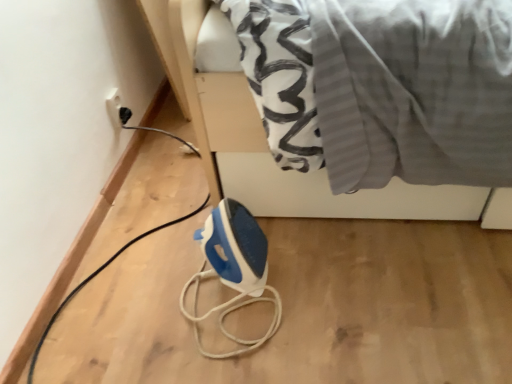
Question: In terms of height, does white glossy bed at upper center look taller or shorter compared to blue plastic iron at lower center?

Choices:
 (A) tall
 (B) short

Answer: (A)

Question: Considering the positions of white glossy bed at upper center and blue plastic iron at lower center in the image, is white glossy bed at upper center wider or thinner than blue plastic iron at lower center?

Choices:
 (A) wide
 (B) thin

Answer: (A)

Question: Which of these objects is positioned farthest from the white glossy bed at upper center?

Choices:
 (A) blue plastic iron at lower center
 (B) white plastic socket at upper left

Answer: (B)

Question: Based on their relative distances, which object is nearer to the blue plastic iron at lower center?

Choices:
 (A) white glossy bed at upper center
 (B) white plastic socket at upper left

Answer: (A)